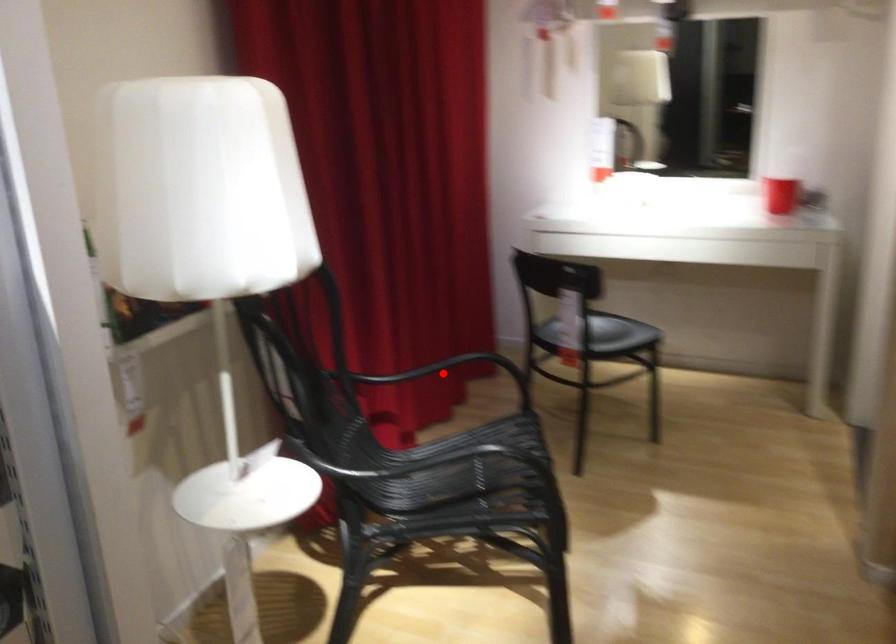
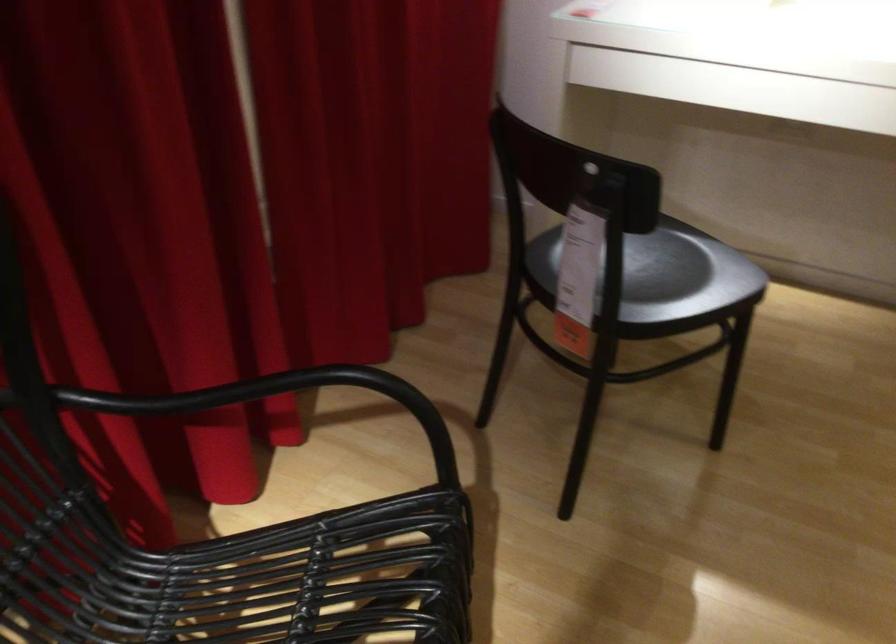
In the second image, find the point that corresponds to the highlighted location in the first image.

(259, 395)